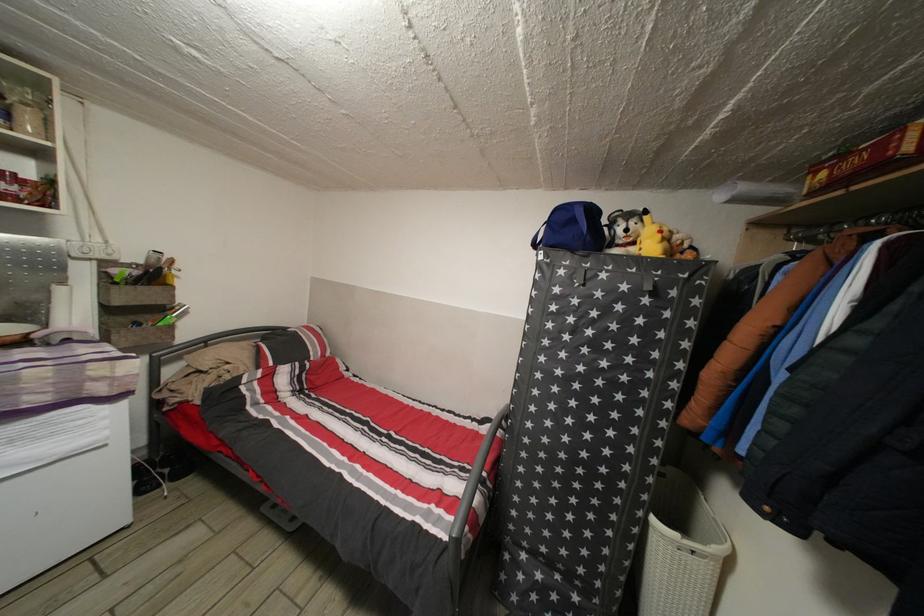
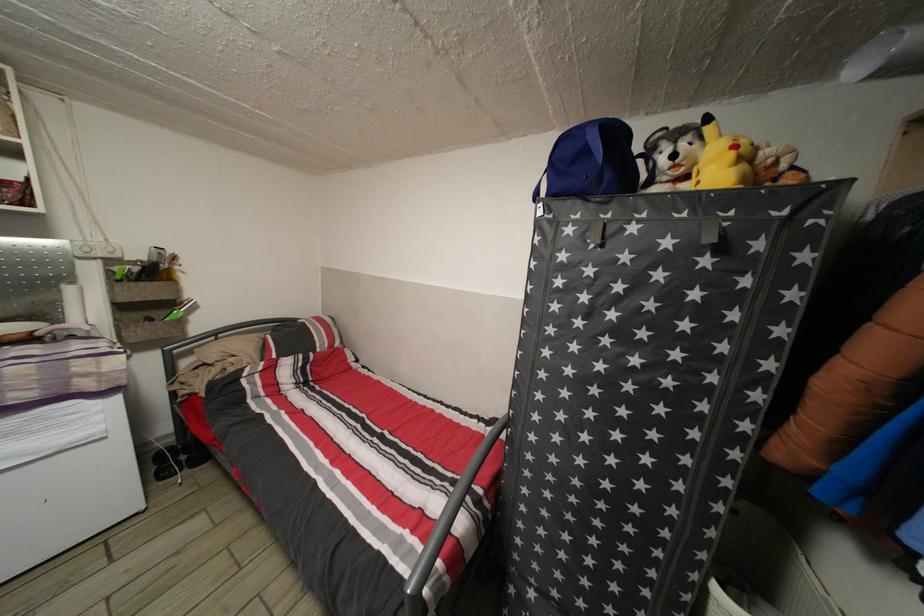
In the second image, find the point that corresponds to point 568,278 in the first image.

(576, 237)